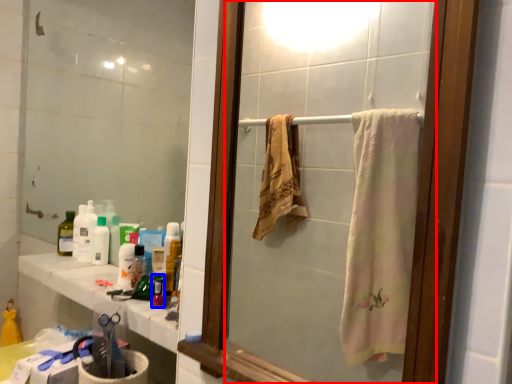
Question: Which of the following is the closest to the observer, mirror (highlighted by a red box) or mouthwash (highlighted by a blue box)?

Choices:
 (A) mirror
 (B) mouthwash

Answer: (A)